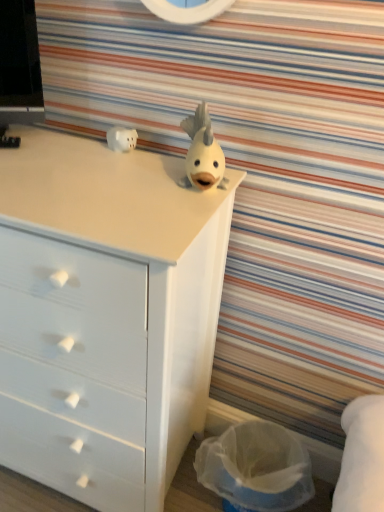
Locate an element on the screen. The width and height of the screenshot is (384, 512). vacant area that lies between white matte fish at center, positioned as the second toy in left-to-right order, and white matte piggy bank at upper left, placed as the 1th toy when sorted from back to front is located at coordinates (163, 163).